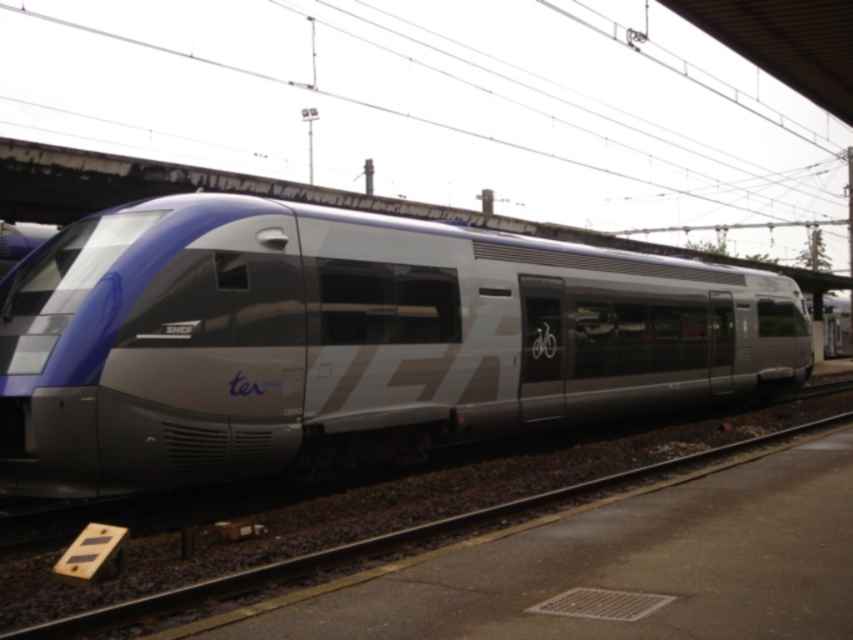
Is matte silver train at center below metallic train track at center?

Actually, matte silver train at center is above metallic train track at center.

Find the location of a particular element. This screenshot has height=640, width=853. matte silver train at center is located at coordinates (345, 339).